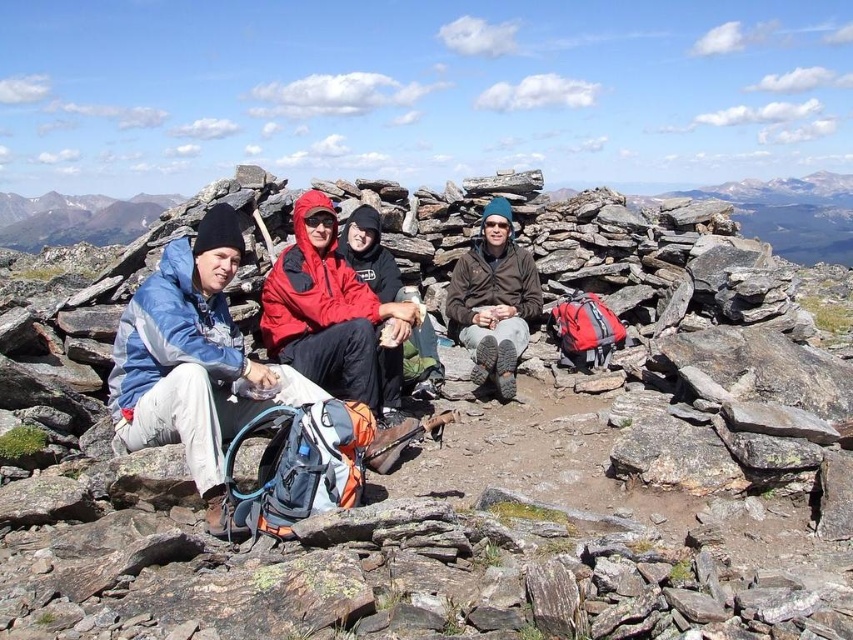
You are planning to take a photo of the rusty metal rock at center and the brown matte jacket at center. Which object should you focus on first if you want to capture both in the same frame without moving the camera?

You should focus on the rusty metal rock at center first because it is much taller than the brown matte jacket at center, so adjusting the focus to its height will ensure both are in the frame.

Looking at this image, you are planning to take a photo of the rusty metal rock at center and the red nylon jacket at center. Which object should you focus on first if you want to ensure both are in the frame without moving the camera?

You should focus on the rusty metal rock at center first because it is taller than the red nylon jacket at center, ensuring it fits within the frame when centered.

You are a geologist examining the image of the mountain summit. You notice a rusty metal rock at center. Can you determine its exact location in the image using coordinates?

The rusty metal rock at center is located at coordinates point [471,476].